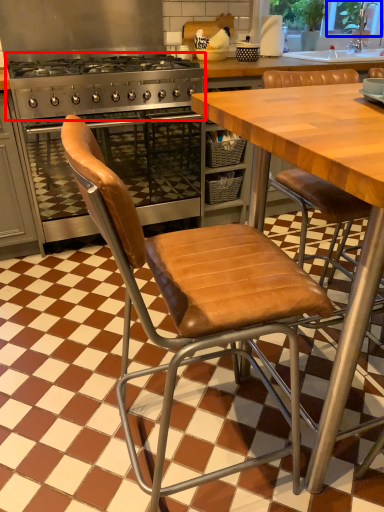
Question: Which object is further to the camera taking this photo, gas stove (highlighted by a red box) or window screen (highlighted by a blue box)?

Choices:
 (A) gas stove
 (B) window screen

Answer: (B)